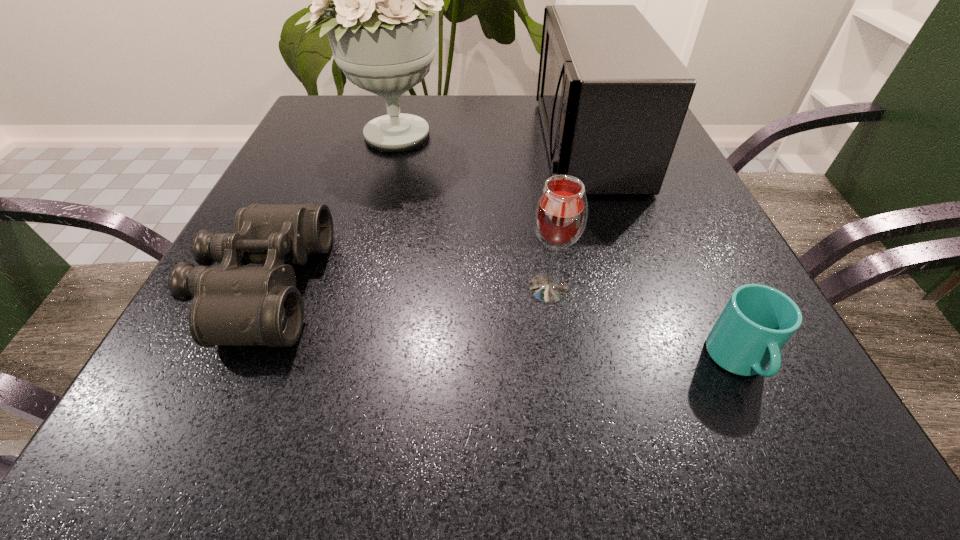
Locate an element on the screen. This screenshot has width=960, height=540. blank region between the wineglass and the cup is located at coordinates (643, 325).

I want to click on vacant space in between the bouquet and the third tallest object, so click(470, 212).

At what (x,y) coordinates should I click in order to perform the action: click on vacant region between the bouquet and the wineglass. Please return your answer as a coordinate pair (x, y). The image size is (960, 540). Looking at the image, I should click on pyautogui.click(x=470, y=212).

What are the coordinates of `vacant space in between the cup and the wineglass` in the screenshot? It's located at (643, 325).

Locate an element on the screen. The image size is (960, 540). vacant space that's between the third shortest object and the cup is located at coordinates (643, 325).

Identify which object is located as the second nearest to the tallest object. Please provide its 2D coordinates. Your answer should be formatted as a tuple, i.e. [(x, y)], where the tuple contains the x and y coordinates of a point satisfying the conditions above.

[(233, 305)]

Where is `object that is the closest to the wineglass`? Image resolution: width=960 pixels, height=540 pixels. object that is the closest to the wineglass is located at coordinates (757, 321).

This screenshot has width=960, height=540. In order to click on vacant space that satisfies the following two spatial constraints: 1. at the eyepieces of the binoculars; 2. on the back side of the third tallest object in this screenshot , I will do `click(261, 289)`.